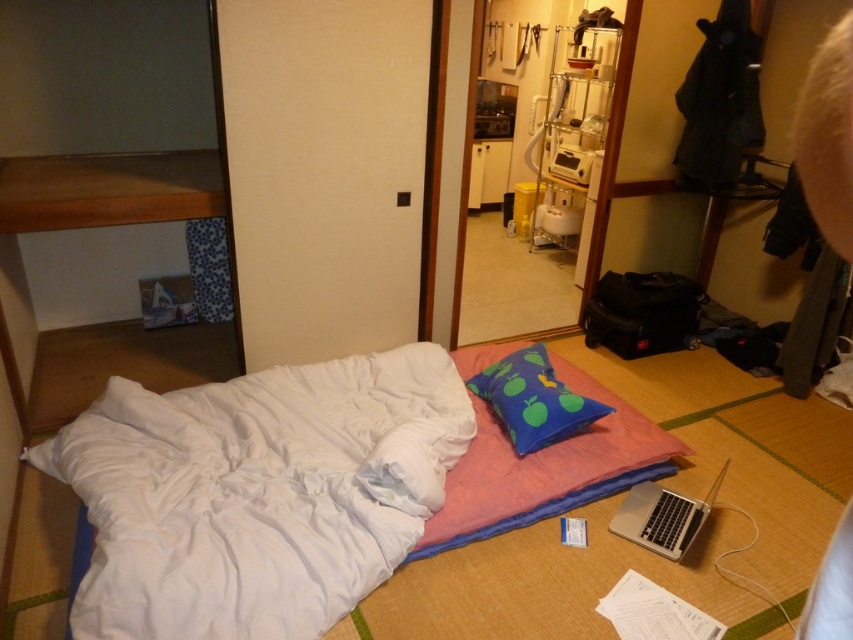
You are standing in the center of the room and want to place a small decorative item exactly where the pink fabric at center is located. What are the coordinates where you should place it?

You should place the small decorative item at the coordinates point (538, 468) where the pink fabric at center is located.

You are moving into this room and need to place a new desk that is 1.2 meters wide. The desk must be placed between the white soft bed at center and the blue fabric pillow at center. Is there enough space between them to fit the desk?

The white soft bed at center is bigger than the blue fabric pillow at center, but the description does not provide the exact distance between them. Therefore, it is impossible to determine if the desk will fit based on the given information.

You are standing in the cozy room with tatami mats. You see two points marked in the image. Which point is closer to you, point (498, 344) or point (657, 504)?

Point (657, 504) is closer to you because it is in front of point (498, 344) according to their spatial arrangement.